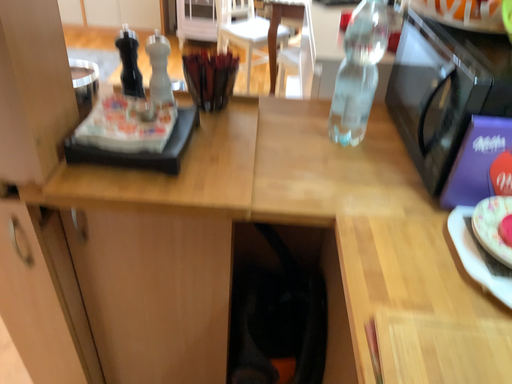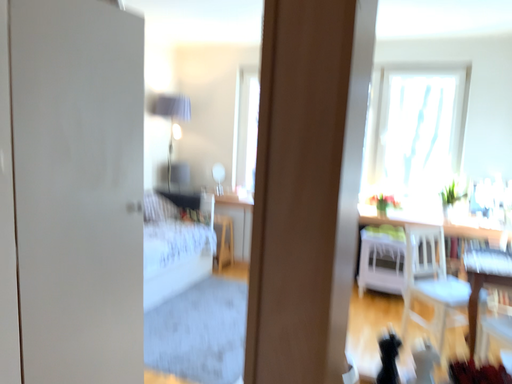
Question: Which way did the camera rotate in the video?

Choices:
 (A) rotated upward
 (B) rotated downward

Answer: (A)